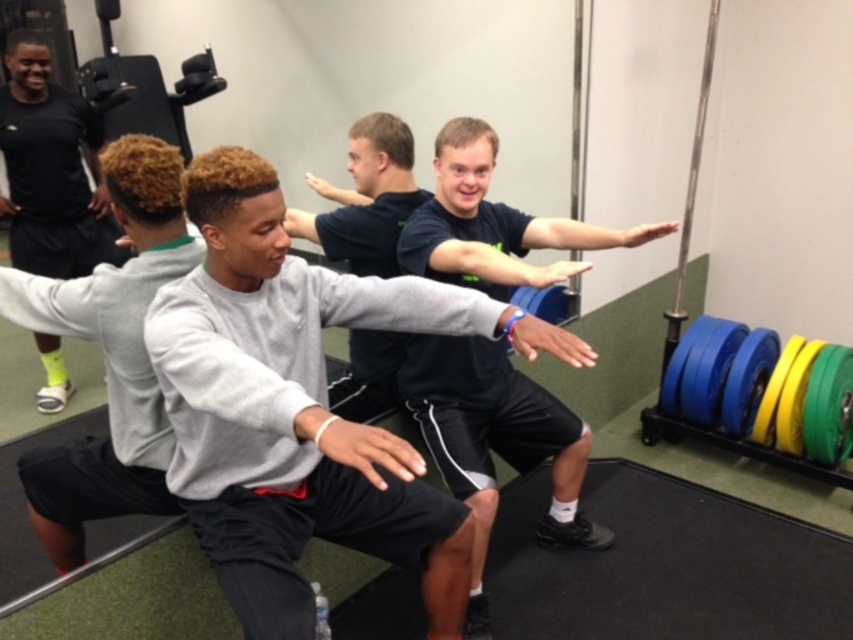
Question: Can you confirm if dark blue shirt at center is positioned to the right of gray sweatshirt at center?

Choices:
 (A) yes
 (B) no

Answer: (A)

Question: Can you confirm if gray matte sweatshirt at center is wider than gray sweatshirt at center?

Choices:
 (A) yes
 (B) no

Answer: (A)

Question: Which object appears closest to the camera in this image?

Choices:
 (A) gray matte sweatshirt at center
 (B) dark blue shirt at center

Answer: (A)

Question: Which object is the closest to the dark blue shirt at center?

Choices:
 (A) gray sweatshirt at center
 (B) black matte shirt at upper left
 (C) gray matte sweatshirt at center

Answer: (C)

Question: Does dark blue shirt at center appear on the left side of black matte shirt at upper left?

Choices:
 (A) yes
 (B) no

Answer: (B)

Question: Which point is farther from the camera taking this photo?

Choices:
 (A) (73, 157)
 (B) (148, 192)
 (C) (474, 480)

Answer: (A)